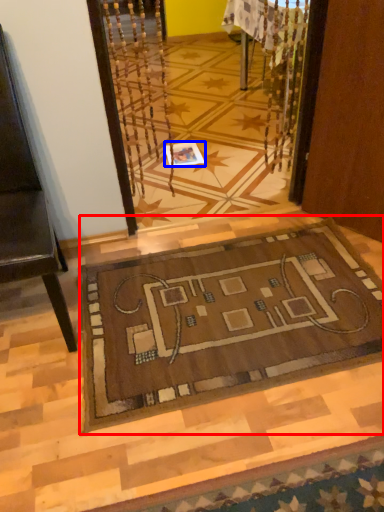
Question: Which of the following is the closest to the observer, mat (highlighted by a red box) or square (highlighted by a blue box)?

Choices:
 (A) mat
 (B) square

Answer: (A)